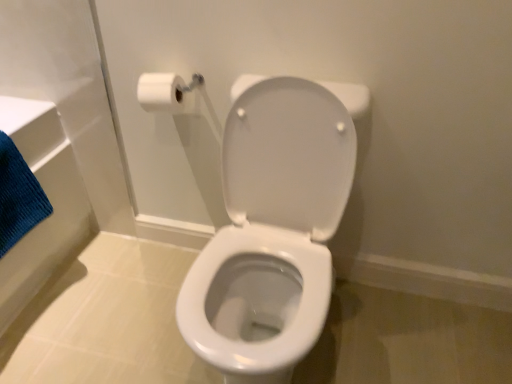
Question: Is white glossy toilet at center oriented towards white matte toilet paper at upper left?

Choices:
 (A) no
 (B) yes

Answer: (A)

Question: Can you confirm if white glossy toilet at center is wider than white matte toilet paper at upper left?

Choices:
 (A) no
 (B) yes

Answer: (B)

Question: Is white glossy toilet at center far away from white matte toilet paper at upper left?

Choices:
 (A) yes
 (B) no

Answer: (B)

Question: Is white glossy toilet at center directly adjacent to white matte toilet paper at upper left?

Choices:
 (A) no
 (B) yes

Answer: (A)

Question: Is white glossy toilet at center taller than white matte toilet paper at upper left?

Choices:
 (A) yes
 (B) no

Answer: (A)

Question: In terms of height, does white matte toilet paper at upper left look taller or shorter compared to white glossy toilet at center?

Choices:
 (A) tall
 (B) short

Answer: (B)

Question: Looking at their shapes, would you say white matte toilet paper at upper left is wider or thinner than white glossy toilet at center?

Choices:
 (A) wide
 (B) thin

Answer: (B)

Question: Looking at the image, does white matte toilet paper at upper left seem bigger or smaller compared to white glossy toilet at center?

Choices:
 (A) big
 (B) small

Answer: (B)

Question: Is white matte toilet paper at upper left in front of or behind white glossy toilet at center in the image?

Choices:
 (A) front
 (B) behind

Answer: (B)

Question: From a real-world perspective, is white matte toilet paper at upper left physically located above or below blue textured bath towel at left?

Choices:
 (A) above
 (B) below

Answer: (A)

Question: In the image, is white matte toilet paper at upper left positioned in front of or behind blue textured bath towel at left?

Choices:
 (A) behind
 (B) front

Answer: (A)

Question: Is white matte toilet paper at upper left to the left or to the right of blue textured bath towel at left in the image?

Choices:
 (A) left
 (B) right

Answer: (B)

Question: Considering the positions of point (159, 89) and point (4, 190), is point (159, 89) closer or farther from the camera than point (4, 190)?

Choices:
 (A) farther
 (B) closer

Answer: (B)

Question: Relative to white matte toilet paper at upper left, is blue textured bath towel at left in front or behind?

Choices:
 (A) front
 (B) behind

Answer: (A)

Question: From the image's perspective, is blue textured bath towel at left located above or below white matte toilet paper at upper left?

Choices:
 (A) below
 (B) above

Answer: (A)